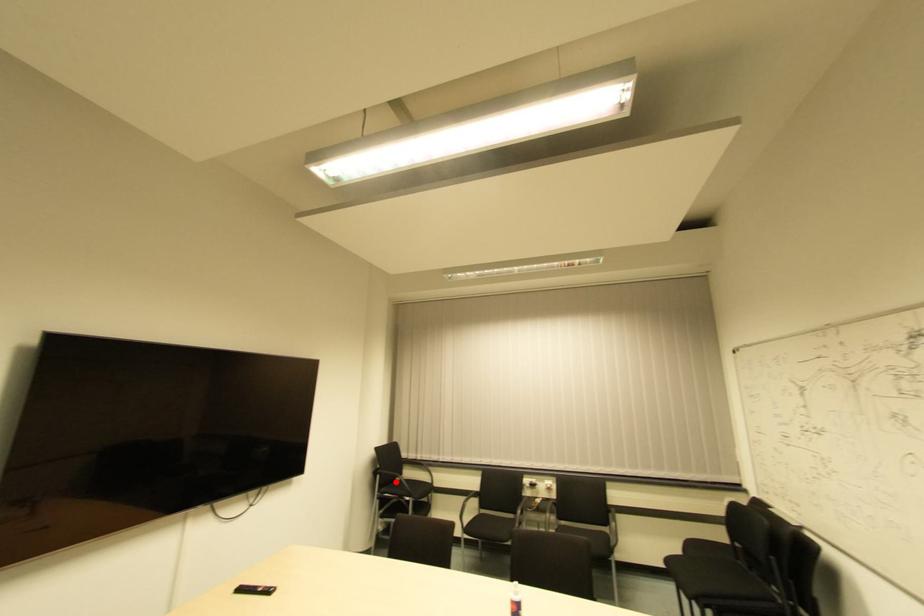
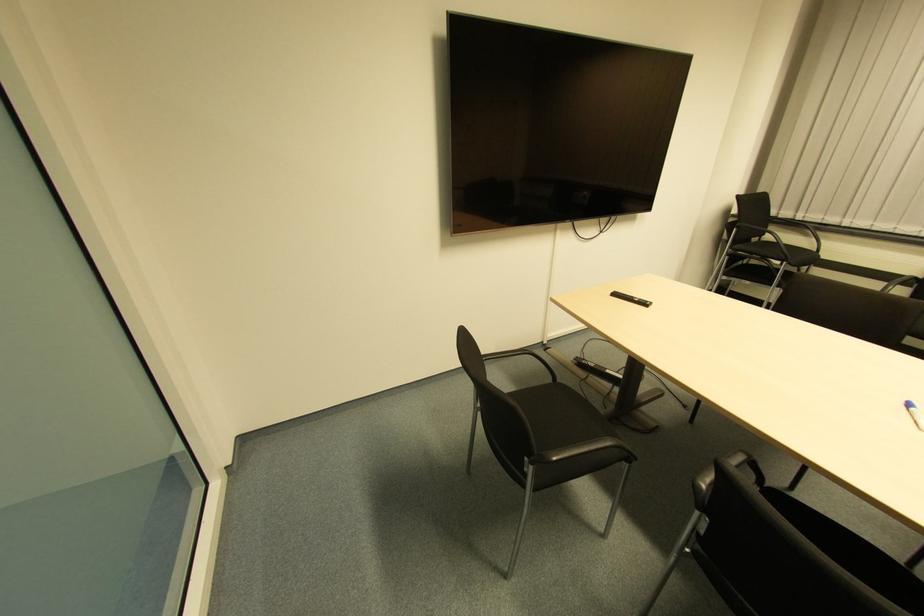
Question: I am providing you with two images of the same scene from different viewpoints. A red point is shown in image1. For the corresponding object point in image2, is it positioned nearer or farther from the camera?

Choices:
 (A) Nearer
 (B) Farther

Answer: (A)